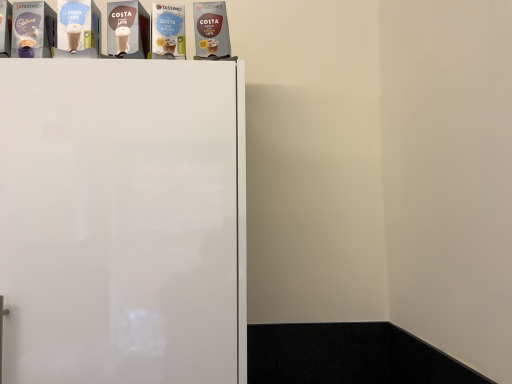
Describe the element at coordinates (123, 221) in the screenshot. I see `white matte cupboard at center` at that location.

This screenshot has height=384, width=512. I want to click on white matte cupboard at center, so coord(123,221).

Where is `white matte cupboard at center`? This screenshot has height=384, width=512. white matte cupboard at center is located at coordinates (123, 221).